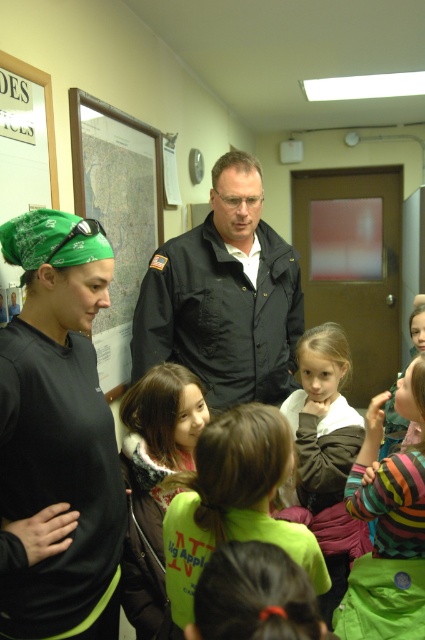
Question: Is green bandana at left closer to camera compared to green fabric shirt at center?

Choices:
 (A) yes
 (B) no

Answer: (B)

Question: Among these points, which one is farthest from the camera?

Choices:
 (A) click(x=78, y=572)
 (B) click(x=119, y=346)

Answer: (B)

Question: Which is farther from the brown fuzzy sweater at center?

Choices:
 (A) green fabric shirt at center
 (B) green bandana at left
 (C) striped fabric shirt at center

Answer: (B)

Question: Estimate the real-world distances between objects in this image. Which object is farther from the green bandana at left?

Choices:
 (A) brown fuzzy sweater at center
 (B) green fabric shirt at center

Answer: (A)

Question: Is the position of dark gray uniform at center more distant than that of green fabric shirt at center?

Choices:
 (A) no
 (B) yes

Answer: (B)

Question: Does green bandana at left have a greater width compared to brown fuzzy sweater at center?

Choices:
 (A) yes
 (B) no

Answer: (B)